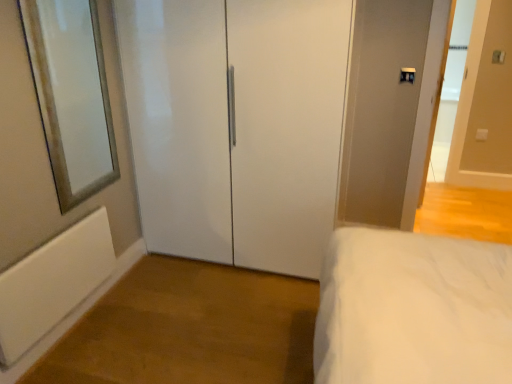
Question: Should I look upward or downward to see silver-framed mirror at left?

Choices:
 (A) up
 (B) down

Answer: (A)

Question: Is white matte radiator at lower left beside silver-framed mirror at left?

Choices:
 (A) yes
 (B) no

Answer: (B)

Question: Does white matte radiator at lower left turn towards silver-framed mirror at left?

Choices:
 (A) no
 (B) yes

Answer: (A)

Question: Is white matte radiator at lower left to the left of silver-framed mirror at left from the viewer's perspective?

Choices:
 (A) no
 (B) yes

Answer: (B)

Question: From a real-world perspective, is white matte radiator at lower left located beneath silver-framed mirror at left?

Choices:
 (A) yes
 (B) no

Answer: (A)

Question: Is white matte radiator at lower left positioned beyond the bounds of silver-framed mirror at left?

Choices:
 (A) no
 (B) yes

Answer: (B)

Question: Considering the relative positions of white matte radiator at lower left and silver-framed mirror at left in the image provided, is white matte radiator at lower left to the right of silver-framed mirror at left from the viewer's perspective?

Choices:
 (A) yes
 (B) no

Answer: (B)

Question: From a real-world perspective, is white glossy closet doors at center, which is the second door in right-to-left order, located higher than white glossy door at upper right, which is the first door in right-to-left order?

Choices:
 (A) no
 (B) yes

Answer: (A)

Question: Is white glossy closet doors at center, positioned as the 1th door in left-to-right order, next to white glossy door at upper right, which is the first door in right-to-left order, and touching it?

Choices:
 (A) yes
 (B) no

Answer: (B)

Question: Is white glossy closet doors at center, which is the second door in right-to-left order, closer to the viewer compared to white glossy door at upper right, marked as the second door in a left-to-right arrangement?

Choices:
 (A) yes
 (B) no

Answer: (A)

Question: Is white glossy closet doors at center, which is the second door in right-to-left order, bigger than white glossy door at upper right, marked as the second door in a left-to-right arrangement?

Choices:
 (A) yes
 (B) no

Answer: (A)

Question: Does white glossy closet doors at center, positioned as the 1th door in left-to-right order, have a greater width compared to white glossy door at upper right, which is the first door in right-to-left order?

Choices:
 (A) no
 (B) yes

Answer: (B)

Question: Could you tell me if white glossy closet doors at center, positioned as the 1th door in left-to-right order, is facing white glossy door at upper right, which is the first door in right-to-left order?

Choices:
 (A) yes
 (B) no

Answer: (B)

Question: From a real-world perspective, is white glossy door at upper right, marked as the second door in a left-to-right arrangement, on top of white glossy closet doors at center, positioned as the 1th door in left-to-right order?

Choices:
 (A) no
 (B) yes

Answer: (B)